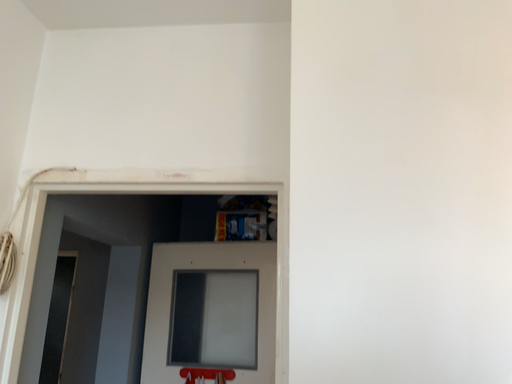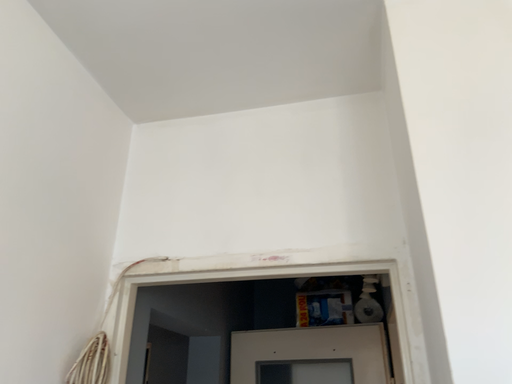
Question: How did the camera likely rotate when shooting the video?

Choices:
 (A) rotated right
 (B) rotated left

Answer: (B)